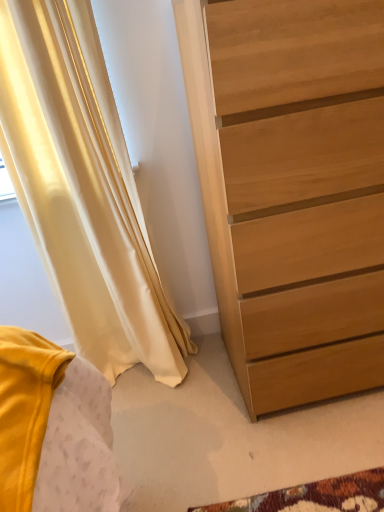
Question: Is light brown wood chest of drawers at right thinner than satin yellow curtain at left?

Choices:
 (A) no
 (B) yes

Answer: (A)

Question: Could satin yellow curtain at left be considered to be inside light brown wood chest of drawers at right?

Choices:
 (A) yes
 (B) no

Answer: (B)

Question: From the image's perspective, is light brown wood chest of drawers at right under satin yellow curtain at left?

Choices:
 (A) no
 (B) yes

Answer: (A)

Question: Is light brown wood chest of drawers at right positioned behind satin yellow curtain at left?

Choices:
 (A) no
 (B) yes

Answer: (A)

Question: Considering the relative sizes of light brown wood chest of drawers at right and satin yellow curtain at left in the image provided, is light brown wood chest of drawers at right smaller than satin yellow curtain at left?

Choices:
 (A) yes
 (B) no

Answer: (B)

Question: Can you confirm if light brown wood chest of drawers at right is shorter than satin yellow curtain at left?

Choices:
 (A) yes
 (B) no

Answer: (A)

Question: From the image's perspective, is satin yellow curtain at left located above light brown wood chest of drawers at right?

Choices:
 (A) yes
 (B) no

Answer: (B)

Question: Is the depth of satin yellow curtain at left greater than that of light brown wood chest of drawers at right?

Choices:
 (A) no
 (B) yes

Answer: (B)

Question: From the image's perspective, is satin yellow curtain at left below light brown wood chest of drawers at right?

Choices:
 (A) no
 (B) yes

Answer: (B)

Question: Is satin yellow curtain at left located outside light brown wood chest of drawers at right?

Choices:
 (A) no
 (B) yes

Answer: (B)

Question: From a real-world perspective, is satin yellow curtain at left located beneath light brown wood chest of drawers at right?

Choices:
 (A) yes
 (B) no

Answer: (B)

Question: Is satin yellow curtain at left not close to light brown wood chest of drawers at right?

Choices:
 (A) no
 (B) yes

Answer: (A)

Question: In terms of height, does light brown wood chest of drawers at right look taller or shorter compared to satin yellow curtain at left?

Choices:
 (A) short
 (B) tall

Answer: (A)